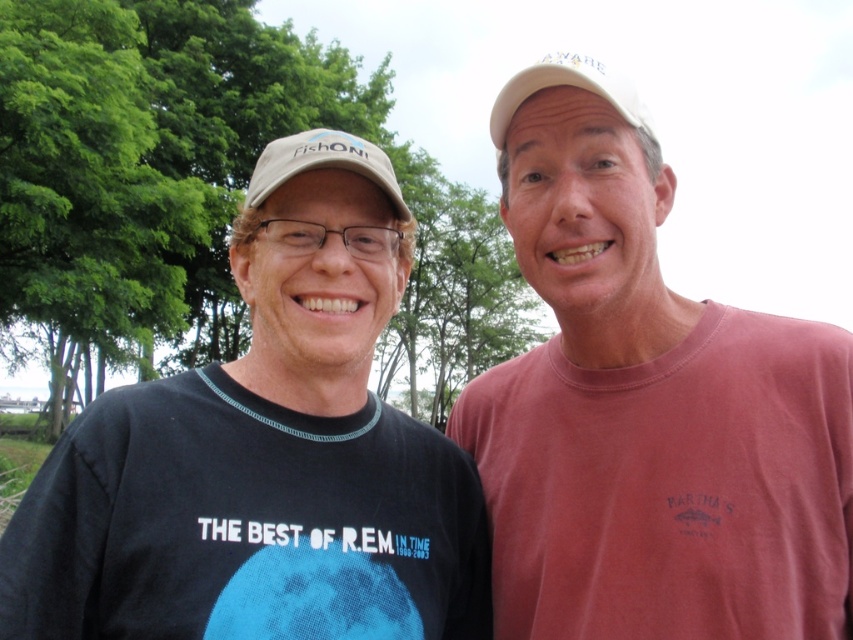
Question: Which point is closer to the camera?

Choices:
 (A) green leafy tree at upper left
 (B) matte beige baseball cap at left

Answer: (B)

Question: Considering the relative positions of pink cotton t-shirt at right and white fabric baseball cap at upper center in the image provided, where is pink cotton t-shirt at right located with respect to white fabric baseball cap at upper center?

Choices:
 (A) above
 (B) below

Answer: (B)

Question: Can you confirm if black cotton t-shirt at left is positioned above matte beige baseball cap at left?

Choices:
 (A) yes
 (B) no

Answer: (B)

Question: Is green leafy tree at upper left smaller than matte beige baseball cap at left?

Choices:
 (A) no
 (B) yes

Answer: (A)

Question: Which object is farther from the camera taking this photo?

Choices:
 (A) black cotton t-shirt at left
 (B) matte beige baseball cap at left
 (C) pink cotton t-shirt at right

Answer: (B)

Question: Among these points, which one is nearest to the camera?

Choices:
 (A) (387, 365)
 (B) (659, 541)
 (C) (321, 129)

Answer: (B)